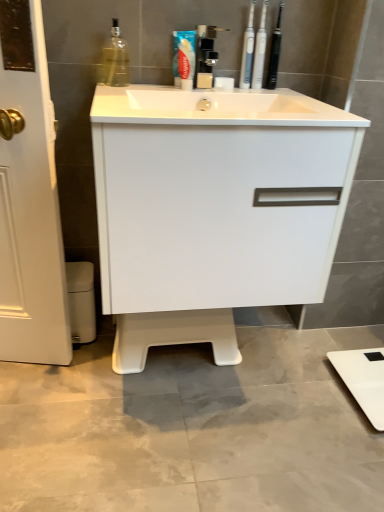
The height and width of the screenshot is (512, 384). Identify the location of vacant point to the left of blue glossy toothpaste at upper center. (148, 88).